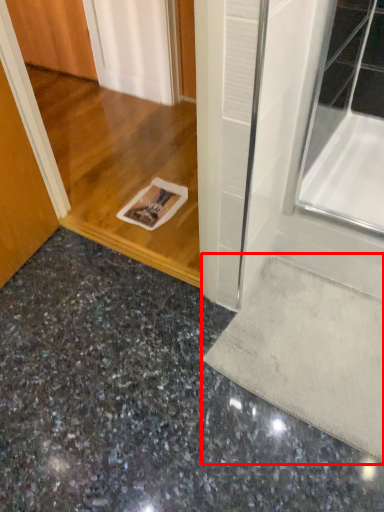
Question: From the image's perspective, where is doormat (annotated by the red box) located in relation to concrete in the image?

Choices:
 (A) below
 (B) above

Answer: (B)